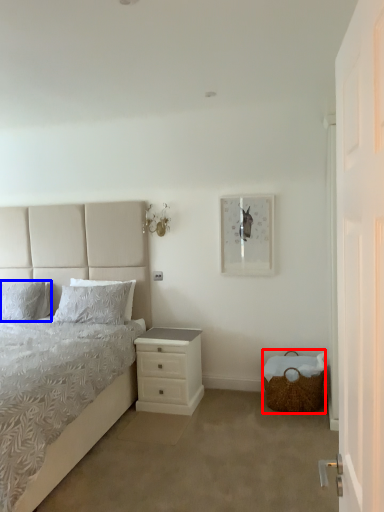
Question: Which of the following is the farthest to the observer, basket (highlighted by a red box) or pillow (highlighted by a blue box)?

Choices:
 (A) basket
 (B) pillow

Answer: (B)